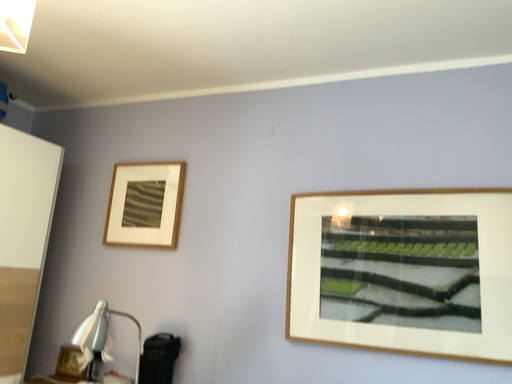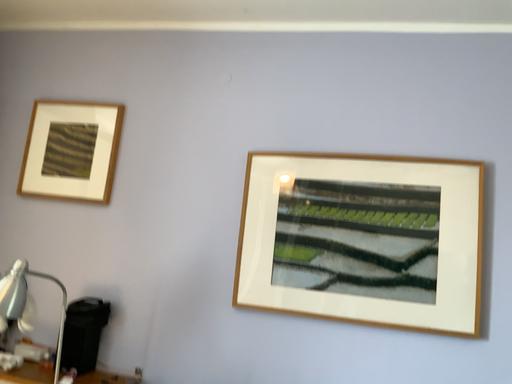
Question: Which way did the camera rotate in the video?

Choices:
 (A) rotated right
 (B) rotated left

Answer: (A)